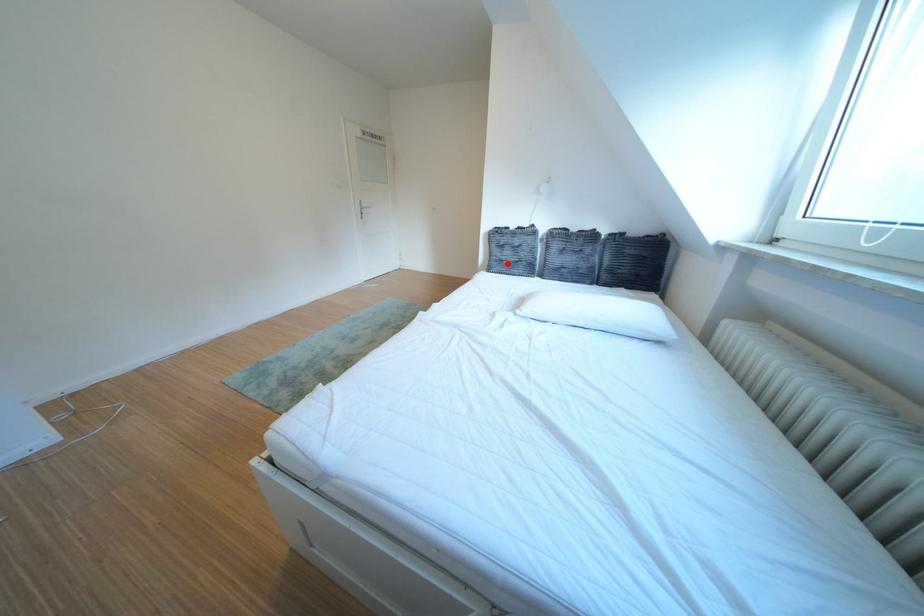
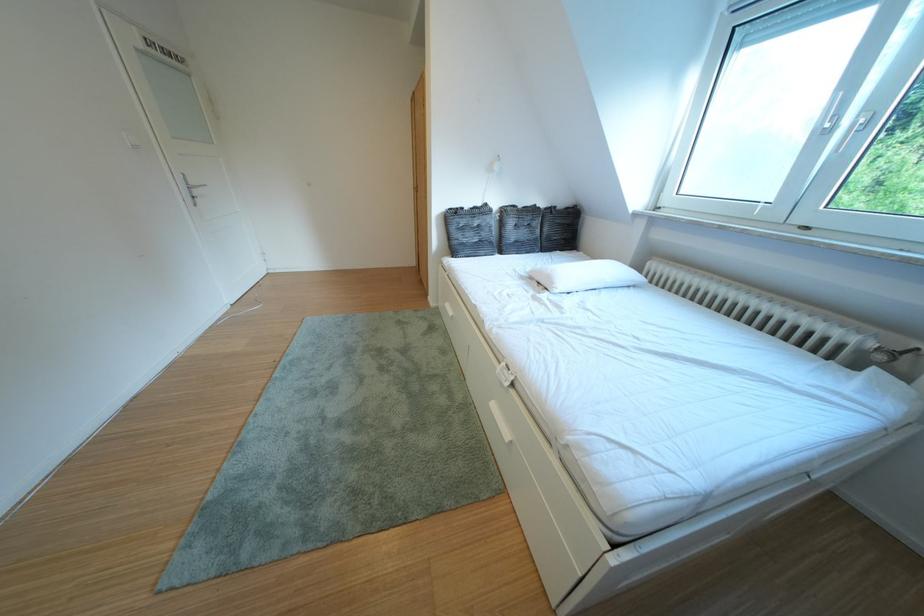
Question: I am providing you with two images of the same scene from different viewpoints. Image1 has a red point marked. In image2, the corresponding 3D location appears at what relative position? Reply with the corresponding letter.

Choices:
 (A) Closer
 (B) Farther

Answer: (B)